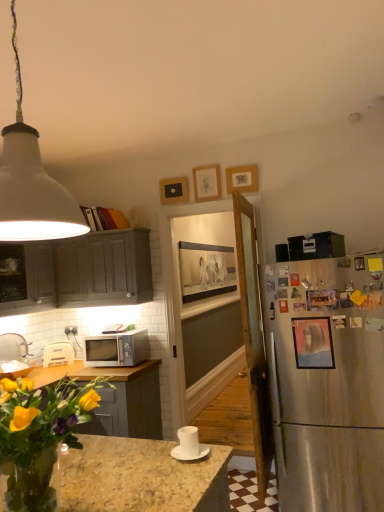
Question: From a real-world perspective, is translucent glass vase at lower left positioned above or below wooden picture frame at right, acting as the 6th picture frame starting from the back?

Choices:
 (A) above
 (B) below

Answer: (B)

Question: Is translucent glass vase at lower left taller or shorter than wooden picture frame at right, marked as the first picture frame in a front-to-back arrangement?

Choices:
 (A) short
 (B) tall

Answer: (B)

Question: Estimate the real-world distances between objects in this image. Which object is closer to the matte wooden picture frame at upper center, the 3th picture frame in the back-to-front sequence?

Choices:
 (A) matte wooden picture frame at center, which is the sixth picture frame in front-to-back order
 (B) white plastic toaster at lower left
 (C) matte gray cabinet at upper left, which is the first cabinetry from right to left
 (D) wooden picture frame at right, marked as the first picture frame in a front-to-back arrangement
 (E) satin silver microwave at lower left

Answer: (C)

Question: Based on their relative distances, which object is farther from the matte pink picture frame at right, marked as the 2th picture frame in a front-to-back arrangement?

Choices:
 (A) white matte pendant light at upper left
 (B) matte gray cabinet at upper left, which is the first cabinetry from right to left
 (C) matte wooden picture frame at upper center, which ranks as the 4th picture frame in front-to-back order
 (D) translucent glass vase at lower left
 (E) wooden picture frame at right, marked as the first picture frame in a front-to-back arrangement

Answer: (B)